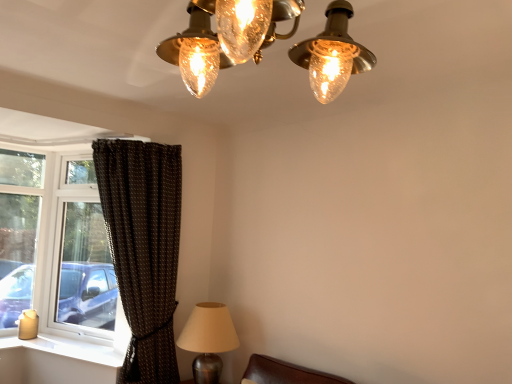
I want to click on metallic silver lamp at lower left, so click(208, 340).

In order to face clear glass window at left, should I rotate leftwards or rightwards?

A 21.792 degree turn to the left will do.

The width and height of the screenshot is (512, 384). I want to click on clear glass window at left, so click(58, 249).

Identify the location of metallic silver lamp at lower left. The image size is (512, 384). (208, 340).

Considering the relative positions of brown textured curtain at left and clear glass window at left in the image provided, is brown textured curtain at left to the right of clear glass window at left from the viewer's perspective?

Yes.

From the image's perspective, between brown textured curtain at left and clear glass window at left, which one is located above?

clear glass window at left appears higher in the image.

Can you confirm if brown textured curtain at left is shorter than clear glass window at left?

In fact, brown textured curtain at left may be taller than clear glass window at left.

In order to click on window that appears on the left of brown textured curtain at left in this screenshot , I will do `click(58, 249)`.

Is white plastic window sill at lower left taller than clear glass window at left?

In fact, white plastic window sill at lower left may be shorter than clear glass window at left.

Can you see white plastic window sill at lower left touching clear glass window at left?

No, white plastic window sill at lower left is not in contact with clear glass window at left.

Between white plastic window sill at lower left and clear glass window at left, which one has smaller size?

Smaller between the two is white plastic window sill at lower left.

Considering their positions, is white plastic window sill at lower left located in front of or behind clear glass window at left?

white plastic window sill at lower left is in front of clear glass window at left.

Between point (92, 310) and point (156, 297), which one is positioned in front?

Positioned in front is point (156, 297).

From their relative heights in the image, would you say clear glass window at left is taller or shorter than brown textured curtain at left?

Clearly, clear glass window at left is shorter compared to brown textured curtain at left.

Is clear glass window at left at the left side of brown textured curtain at left?

Yes, clear glass window at left is to the left of brown textured curtain at left.

Is clear glass window at left wider than brown textured curtain at left?

Incorrect, the width of clear glass window at left does not surpass that of brown textured curtain at left.

Measure the distance between white plastic window sill at lower left and brown textured curtain at left.

white plastic window sill at lower left and brown textured curtain at left are 31.93 inches apart from each other.

Can we say white plastic window sill at lower left lies outside brown textured curtain at left?

Yes, white plastic window sill at lower left is not within brown textured curtain at left.

This screenshot has width=512, height=384. I want to click on curtain above the white plastic window sill at lower left (from the image's perspective), so click(x=143, y=248).

From the image's perspective, which object appears higher, metallic silver lamp at lower left or clear glass window at left?

clear glass window at left is shown above in the image.

Identify the location of window that appears above the metallic silver lamp at lower left (from a real-world perspective). (58, 249).

Is metallic silver lamp at lower left in front of or behind clear glass window at left in the image?

In the image, metallic silver lamp at lower left appears in front of clear glass window at left.

How much distance is there between metallic silver lamp at lower left and white plastic window sill at lower left?

A distance of 79.16 centimeters exists between metallic silver lamp at lower left and white plastic window sill at lower left.

From the picture: Can you confirm if metallic silver lamp at lower left is positioned to the right of white plastic window sill at lower left?

Indeed, metallic silver lamp at lower left is positioned on the right side of white plastic window sill at lower left.

Does point (237, 344) appear closer or farther from the camera than point (88, 350)?

Point (237, 344) is positioned closer to the camera compared to point (88, 350).

Considering the positions of objects metallic silver lamp at lower left and white plastic window sill at lower left in the image provided, who is behind, metallic silver lamp at lower left or white plastic window sill at lower left?

white plastic window sill at lower left is further away from the camera.

From the image's perspective, is brown textured curtain at left located above white plastic window sill at lower left?

Indeed, from the image's perspective, brown textured curtain at left is shown above white plastic window sill at lower left.

Looking at this image, is white plastic window sill at lower left at the back of brown textured curtain at left?

No.

Which is farther from the camera, (179, 219) or (72, 350)?

The point (72, 350) is farther.

Can you confirm if brown textured curtain at left is positioned to the right of white plastic window sill at lower left?

Yes, brown textured curtain at left is to the right of white plastic window sill at lower left.

In order to click on window located above the brown textured curtain at left (from the image's perspective) in this screenshot , I will do `click(58, 249)`.

Where is `window sill in front of the clear glass window at left`? window sill in front of the clear glass window at left is located at coordinates (68, 348).

From the image, which object appears to be farther from white plastic window sill at lower left, clear glass window at left or brown textured curtain at left?

brown textured curtain at left is further to white plastic window sill at lower left.

Which object lies nearer to the anchor point white plastic window sill at lower left, brown textured curtain at left or metallic silver lamp at lower left?

metallic silver lamp at lower left is closer to white plastic window sill at lower left.

Which object lies nearer to the anchor point brown textured curtain at left, white plastic window sill at lower left or metallic silver lamp at lower left?

Among the two, metallic silver lamp at lower left is located nearer to brown textured curtain at left.

When comparing their distances from metallic silver lamp at lower left, does clear glass window at left or white plastic window sill at lower left seem closer?

The object closer to metallic silver lamp at lower left is white plastic window sill at lower left.

Looking at the image, which one is located closer to brown textured curtain at left, metallic silver lamp at lower left or clear glass window at left?

metallic silver lamp at lower left.

Estimate the real-world distances between objects in this image. Which object is closer to white plastic window sill at lower left, brown textured curtain at left or clear glass window at left?

Among the two, clear glass window at left is located nearer to white plastic window sill at lower left.

Considering their positions, is metallic silver lamp at lower left positioned further to white plastic window sill at lower left than clear glass window at left?

metallic silver lamp at lower left lies further to white plastic window sill at lower left than the other object.

Considering their positions, is metallic silver lamp at lower left positioned further to brown textured curtain at left than white plastic window sill at lower left?

white plastic window sill at lower left lies further to brown textured curtain at left than the other object.

The image size is (512, 384). I want to click on window sill situated between clear glass window at left and metallic silver lamp at lower left from left to right, so click(68, 348).

This screenshot has height=384, width=512. Find the location of `curtain that lies between clear glass window at left and white plastic window sill at lower left from top to bottom`. curtain that lies between clear glass window at left and white plastic window sill at lower left from top to bottom is located at coordinates (143, 248).

Where is `curtain between white plastic window sill at lower left and metallic silver lamp at lower left from left to right`? The width and height of the screenshot is (512, 384). curtain between white plastic window sill at lower left and metallic silver lamp at lower left from left to right is located at coordinates (143, 248).

Where is `curtain between clear glass window at left and metallic silver lamp at lower left from left to right`? The image size is (512, 384). curtain between clear glass window at left and metallic silver lamp at lower left from left to right is located at coordinates (143, 248).